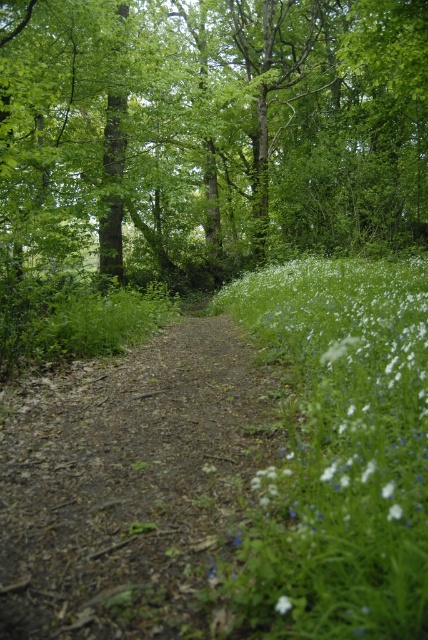
Question: Does dirt path at center appear on the left side of white matte flower at lower right?

Choices:
 (A) no
 (B) yes

Answer: (B)

Question: Estimate the real-world distances between objects in this image. Which object is farther from the white matte flower at lower center?

Choices:
 (A) green leafy tree at center
 (B) dirt path at center
 (C) white matte flower at lower right
 (D) white soft grass at right

Answer: (A)

Question: Which object is positioned closest to the white soft grass at right?

Choices:
 (A) white matte flower at lower center
 (B) white matte flower at lower right
 (C) dirt path at center

Answer: (C)

Question: Among these objects, which one is farthest from the camera?

Choices:
 (A) white soft grass at right
 (B) white matte flower at lower right
 (C) green leafy tree at center
 (D) white matte flower at lower center

Answer: (C)

Question: Does green leafy tree at center appear under dirt path at center?

Choices:
 (A) no
 (B) yes

Answer: (A)

Question: Where is green leafy tree at center located in relation to white matte flower at lower right in the image?

Choices:
 (A) right
 (B) left

Answer: (B)